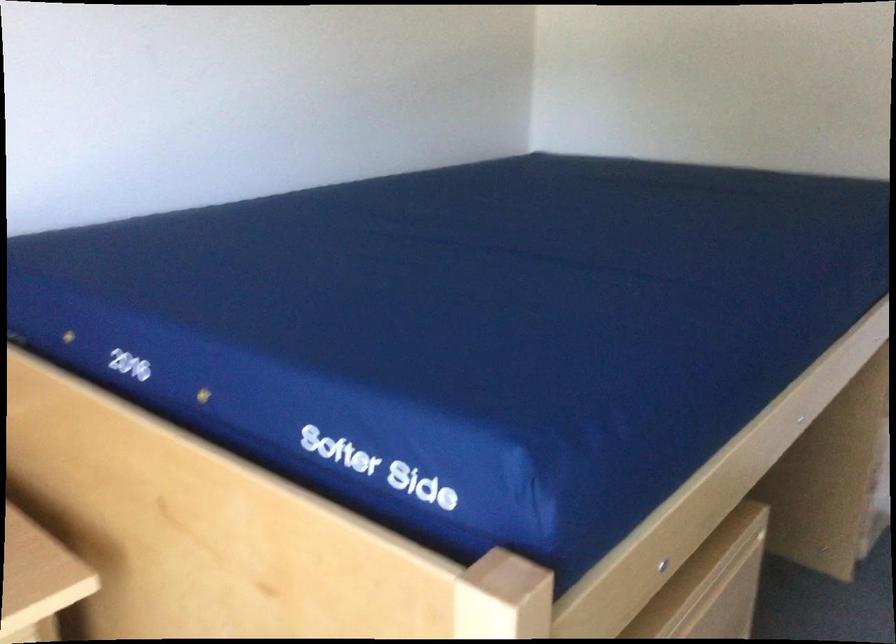
What do you see at coordinates (469, 299) in the screenshot? Image resolution: width=896 pixels, height=644 pixels. I see `a blue mattress surface` at bounding box center [469, 299].